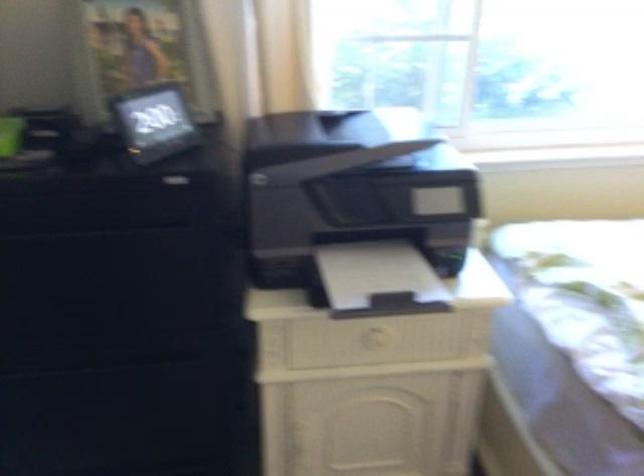
Find the location of a particular element. The height and width of the screenshot is (476, 644). picture frame is located at coordinates (152, 48).